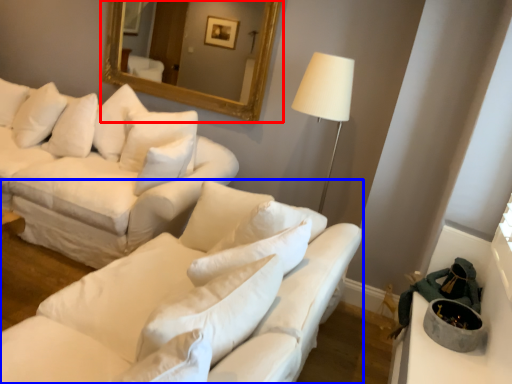
Question: Which of the following is the farthest to the observer, mirror (highlighted by a red box) or studio couch (highlighted by a blue box)?

Choices:
 (A) mirror
 (B) studio couch

Answer: (A)